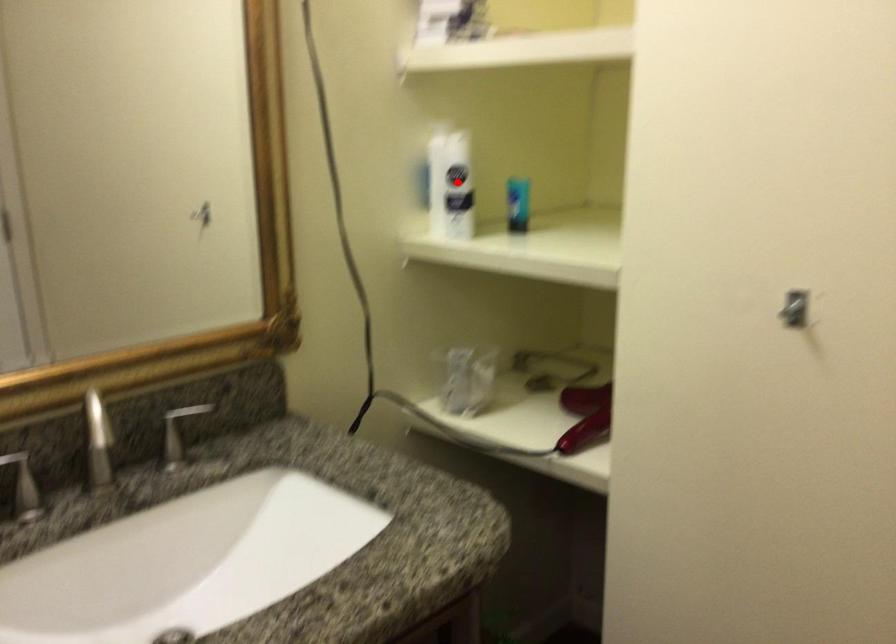
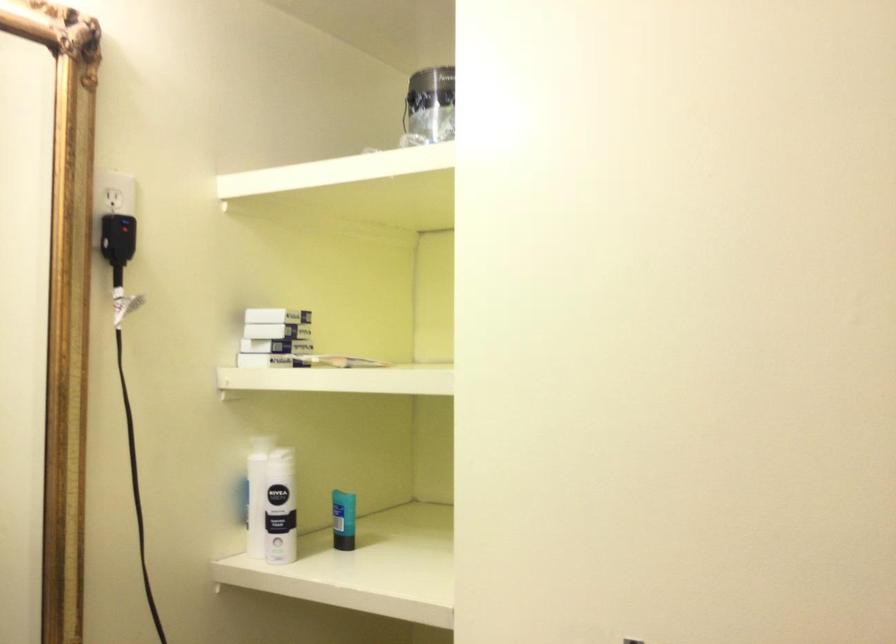
Find the pixel in the second image that matches the highlighted location in the first image.

(271, 504)